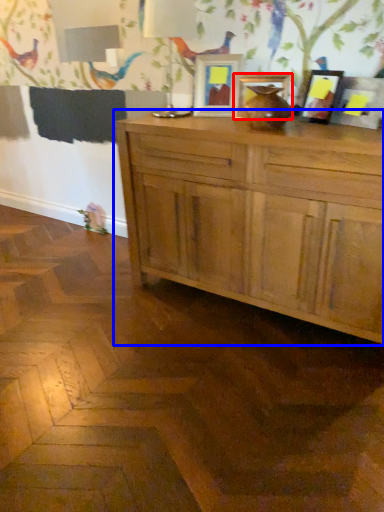
Question: Which object is closer to the camera taking this photo, picture frame (highlighted by a red box) or cabinetry (highlighted by a blue box)?

Choices:
 (A) picture frame
 (B) cabinetry

Answer: (B)